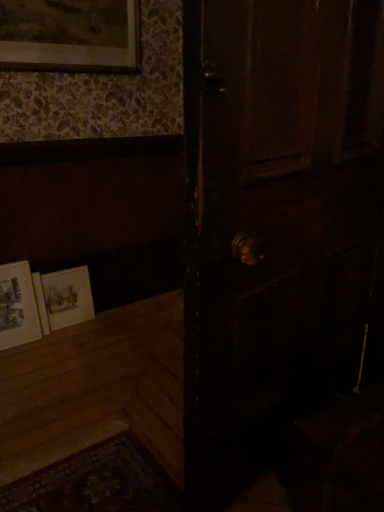
Question: From their relative heights in the image, would you say matte paper picture frame at lower left, the 1th picture frame in the bottom-to-top sequence, is taller or shorter than matte white picture frame at lower left, the second picture frame in the bottom-to-top sequence?

Choices:
 (A) tall
 (B) short

Answer: (A)

Question: From a real-world perspective, is matte paper picture frame at lower left, the 1th picture frame in the bottom-to-top sequence, positioned above or below matte white picture frame at lower left, arranged as the 2th picture frame when viewed from the top?

Choices:
 (A) above
 (B) below

Answer: (A)

Question: Based on their relative distances, which object is farther from the dark wood door at center?

Choices:
 (A) matte paper picture frame at lower left, the 1th picture frame in the bottom-to-top sequence
 (B) matte white picture frame at lower left, the second picture frame in the bottom-to-top sequence
 (C) matte gold picture frame at upper left, the 3th picture frame from the bottom

Answer: (A)

Question: Estimate the real-world distances between objects in this image. Which object is farther from the matte white picture frame at lower left, the second picture frame in the bottom-to-top sequence?

Choices:
 (A) matte paper picture frame at lower left, which is the third picture frame from top to bottom
 (B) dark wood door at center
 (C) matte gold picture frame at upper left, the 3th picture frame from the bottom

Answer: (B)